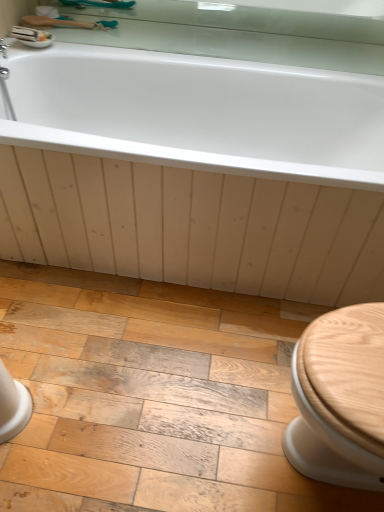
You are a GUI agent. You are given a task and a screenshot of the screen. Output one action in this format:
    pyautogui.click(x=<x>, y=<y>)
    Task: Click on the unoccupied area in front of white glossy sink at upper left
    Image resolution: width=384 pixels, height=512 pixels.
    Given the screenshot: What is the action you would take?
    pyautogui.click(x=21, y=46)